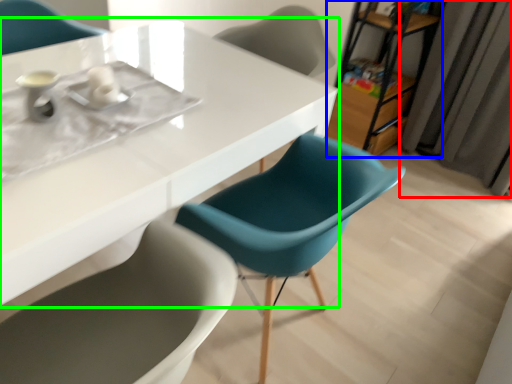
Question: Considering the real-world distances, which object is farthest from curtain (highlighted by a red box)? bookshelf (highlighted by a blue box) or table (highlighted by a green box)?

Choices:
 (A) bookshelf
 (B) table

Answer: (B)